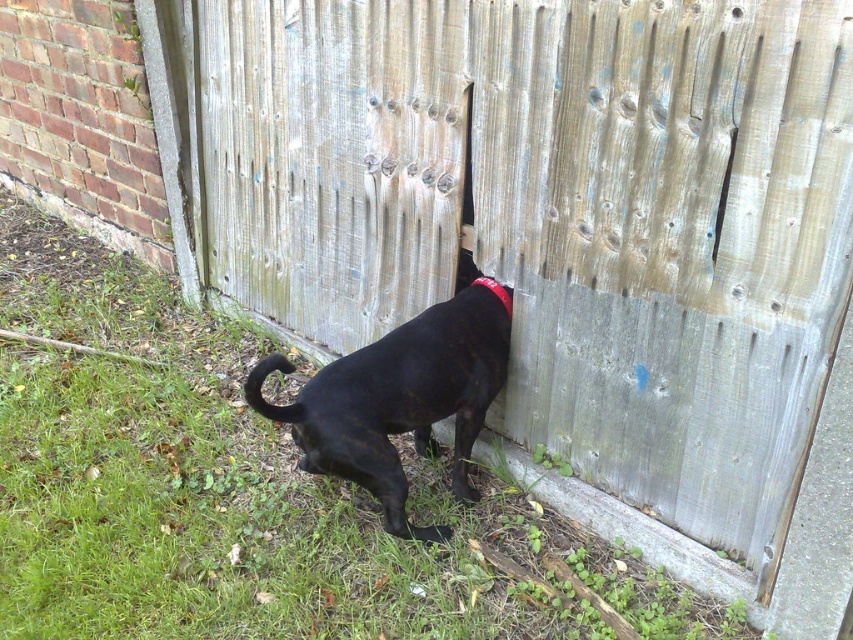
Question: Which point appears closest to the camera in this image?

Choices:
 (A) (386, 376)
 (B) (503, 307)

Answer: (A)

Question: Which object appears closest to the camera in this image?

Choices:
 (A) red fabric neckband at center
 (B) black matte dog at center

Answer: (B)

Question: Can you confirm if black matte dog at center is positioned below red fabric neckband at center?

Choices:
 (A) yes
 (B) no

Answer: (A)

Question: Which point appears closest to the camera in this image?

Choices:
 (A) (405, 355)
 (B) (497, 289)

Answer: (A)

Question: Is black matte dog at center above red fabric neckband at center?

Choices:
 (A) yes
 (B) no

Answer: (B)

Question: Is black matte dog at center below red fabric neckband at center?

Choices:
 (A) yes
 (B) no

Answer: (A)